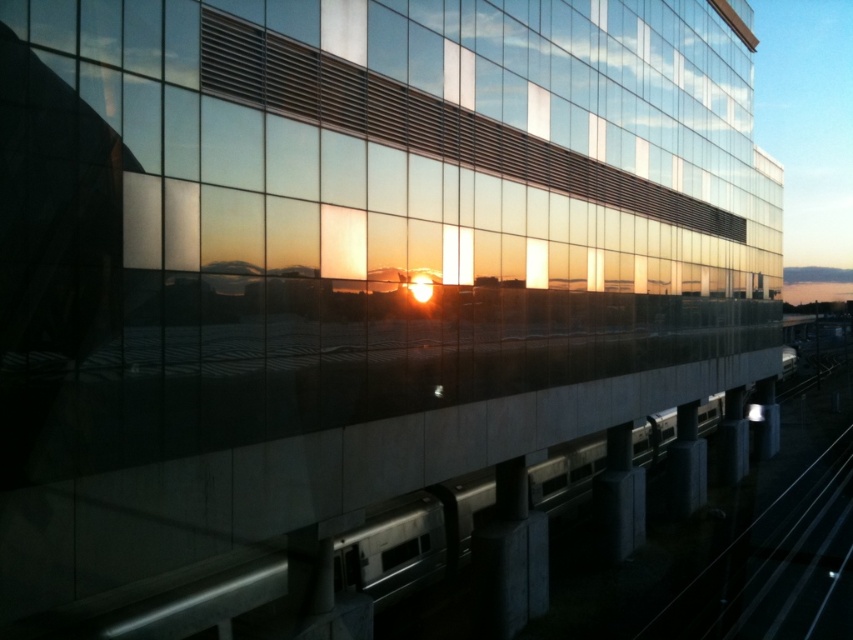
Question: Can you confirm if black metal train track at lower right is smaller than silver metallic train at center?

Choices:
 (A) no
 (B) yes

Answer: (B)

Question: Where is black metal train track at lower right located in relation to silver metallic train at center in the image?

Choices:
 (A) below
 (B) above

Answer: (A)

Question: Can you confirm if black metal train track at lower right is positioned above silver metallic train at center?

Choices:
 (A) no
 (B) yes

Answer: (A)

Question: Among these points, which one is farthest from the camera?

Choices:
 (A) (412, 538)
 (B) (822, 552)

Answer: (B)